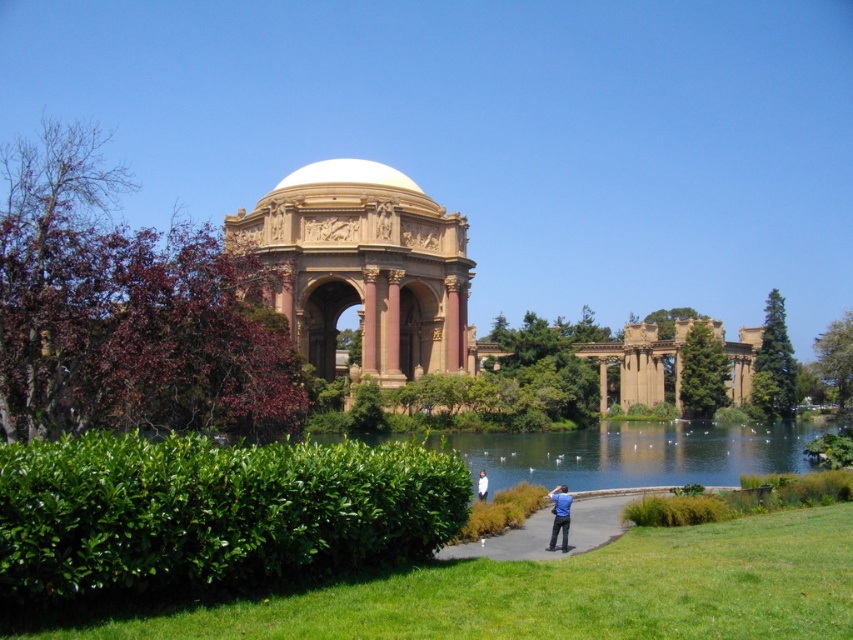
How much distance is there between green leafy hedge at lower left and green leafy bush at center?

They are 244.14 feet apart.

Find the location of `green leafy hedge at lower left`. green leafy hedge at lower left is located at coordinates (212, 513).

Consider the image. Who is positioned more to the right, golden stone palace at center or green leafy bush at center-right?

From the viewer's perspective, green leafy bush at center-right appears more on the right side.

Which is below, golden stone palace at center or green leafy bush at center-right?

green leafy bush at center-right

Image resolution: width=853 pixels, height=640 pixels. In order to click on golden stone palace at center in this screenshot , I will do `click(368, 276)`.

Can you confirm if green leafy bush at center-right is positioned to the right of blue cotton shirt at center?

Yes, green leafy bush at center-right is to the right of blue cotton shirt at center.

Between green leafy bush at center-right and blue cotton shirt at center, which one has more height?

With more height is green leafy bush at center-right.

Which is behind, point (788, 376) or point (486, 484)?

The point (788, 376) is more distant.

The width and height of the screenshot is (853, 640). Find the location of `green leafy bush at center-right`. green leafy bush at center-right is located at coordinates (775, 362).